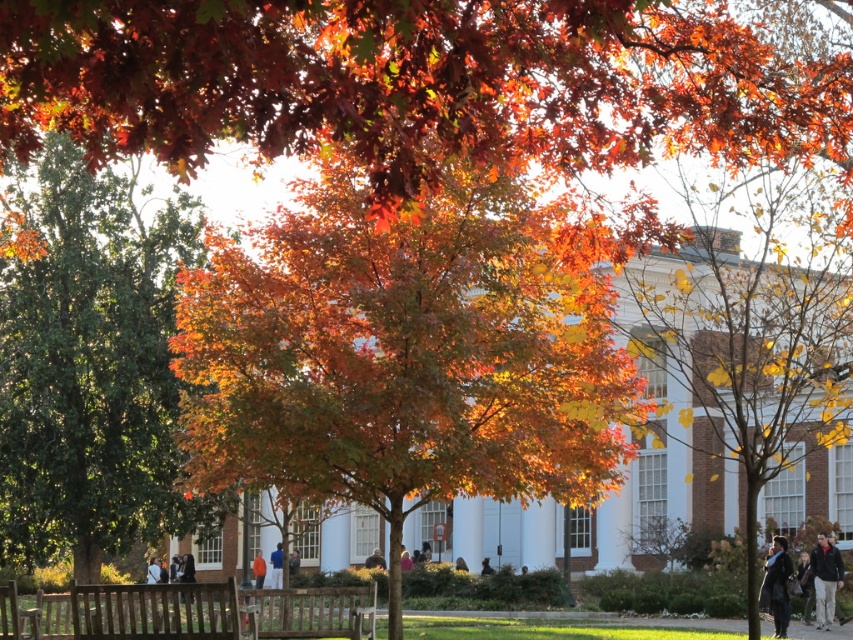
Does point (479, 376) come behind point (281, 564)?

No, it is not.

How distant is orange leafy tree at center from orange shirt at center?

A distance of 39.88 meters exists between orange leafy tree at center and orange shirt at center.

Describe the element at coordinates (407, 353) in the screenshot. This screenshot has height=640, width=853. I see `orange leafy tree at center` at that location.

You are a GUI agent. You are given a task and a screenshot of the screen. Output one action in this format:
    pyautogui.click(x=<x>, y=<y>)
    Task: Click on the orange leafy tree at center
    This screenshot has width=853, height=640.
    Given the screenshot: What is the action you would take?
    pyautogui.click(x=407, y=353)

Which of these two, orange shirt at center or orange fabric at center, stands shorter?

With less height is orange fabric at center.

The image size is (853, 640). In order to click on orange shirt at center in this screenshot , I will do click(276, 566).

Can you confirm if shiny green tree at center is wider than dark gray sweater at lower right?

Indeed, shiny green tree at center has a greater width compared to dark gray sweater at lower right.

Does shiny green tree at center have a lesser height compared to dark gray sweater at lower right?

In fact, shiny green tree at center may be taller than dark gray sweater at lower right.

Which is in front, point (32, 236) or point (838, 563)?

Point (838, 563)

You are a GUI agent. You are given a task and a screenshot of the screen. Output one action in this format:
    pyautogui.click(x=<x>, y=<y>)
    Task: Click on the shiny green tree at center
    This screenshot has height=640, width=853.
    Given the screenshot: What is the action you would take?
    coord(90,365)